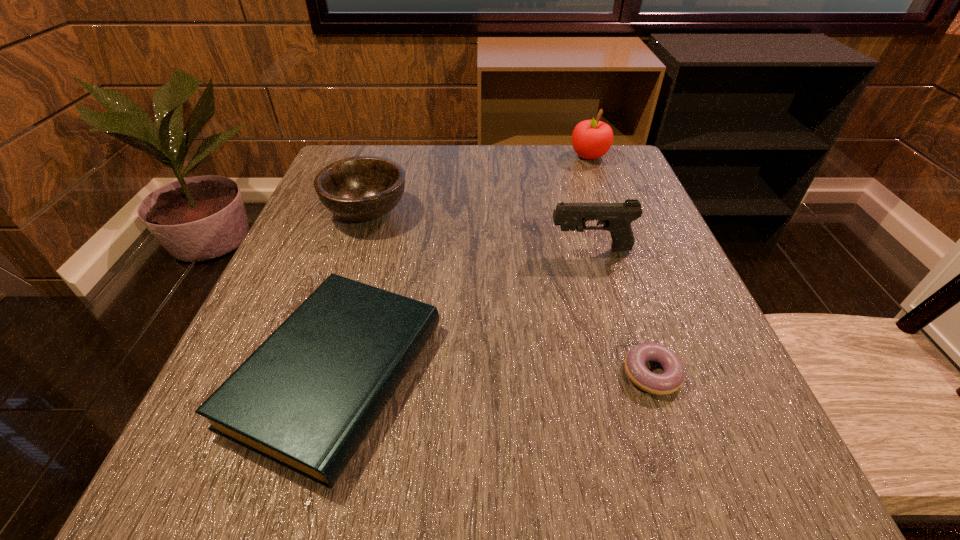
Find the location of a particular element. doughnut present at the right edge is located at coordinates (671, 380).

You are a GUI agent. You are given a task and a screenshot of the screen. Output one action in this format:
    pyautogui.click(x=<x>, y=<y>)
    Task: Click on the object that is at the far left corner
    Image resolution: width=960 pixels, height=540 pixels.
    Given the screenshot: What is the action you would take?
    pyautogui.click(x=361, y=188)

Locate an element on the screen. The width and height of the screenshot is (960, 540). object present at the near left corner is located at coordinates (306, 398).

Locate an element on the screen. This screenshot has width=960, height=540. object that is at the far right corner is located at coordinates (591, 139).

At what (x,y) coordinates should I click in order to perform the action: click on vacant region at the far edge. Please return your answer as a coordinate pair (x, y). The image size is (960, 540). Looking at the image, I should click on (448, 160).

Image resolution: width=960 pixels, height=540 pixels. I want to click on blank space at the left edge of the desktop, so pyautogui.click(x=318, y=205).

What are the coordinates of `free region at the right edge of the desktop` in the screenshot? It's located at (660, 290).

Image resolution: width=960 pixels, height=540 pixels. What are the coordinates of `vacant position at the near left corner of the desktop` in the screenshot? It's located at (214, 494).

Where is `free region at the far right corner of the desktop`? This screenshot has height=540, width=960. free region at the far right corner of the desktop is located at coordinates (636, 177).

The image size is (960, 540). I want to click on vacant area at the near right corner, so click(748, 488).